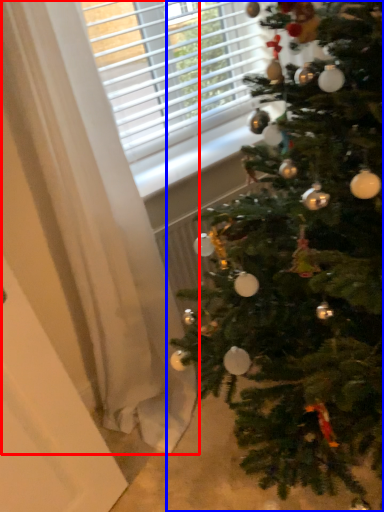
Question: Which point is further to the camera, curtain (highlighted by a red box) or christmas tree (highlighted by a blue box)?

Choices:
 (A) curtain
 (B) christmas tree

Answer: (A)